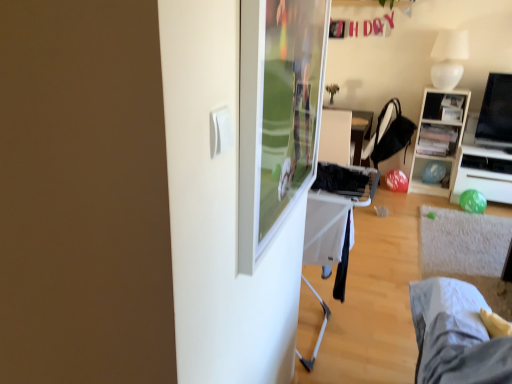
Question: Is black fabric chair at center far from wooden shelf at upper right?

Choices:
 (A) yes
 (B) no

Answer: (B)

Question: Is black fabric chair at center in contact with wooden shelf at upper right?

Choices:
 (A) yes
 (B) no

Answer: (B)

Question: From the image's perspective, would you say black fabric chair at center is positioned over wooden shelf at upper right?

Choices:
 (A) yes
 (B) no

Answer: (A)

Question: Is black fabric chair at center positioned in front of wooden shelf at upper right?

Choices:
 (A) no
 (B) yes

Answer: (B)

Question: Is wooden shelf at upper right completely or partially inside black fabric chair at center?

Choices:
 (A) yes
 (B) no

Answer: (B)

Question: Considering the positions of point (340, 127) and point (373, 144), is point (340, 127) closer or farther from the camera than point (373, 144)?

Choices:
 (A) farther
 (B) closer

Answer: (B)

Question: From their relative heights in the image, would you say black plastic table at center is taller or shorter than black fabric chair at center?

Choices:
 (A) tall
 (B) short

Answer: (A)

Question: Considering the positions of black plastic table at center and black fabric chair at center in the image, is black plastic table at center bigger or smaller than black fabric chair at center?

Choices:
 (A) small
 (B) big

Answer: (B)

Question: From the image's perspective, relative to black fabric chair at center, is black plastic table at center above or below?

Choices:
 (A) below
 (B) above

Answer: (A)

Question: From the image's perspective, is black glossy tv at right located above or below black plastic table at center?

Choices:
 (A) above
 (B) below

Answer: (A)

Question: Is black glossy tv at right inside or outside of black plastic table at center?

Choices:
 (A) inside
 (B) outside

Answer: (B)

Question: Considering their positions, is black glossy tv at right located in front of or behind black plastic table at center?

Choices:
 (A) behind
 (B) front

Answer: (A)

Question: From a real-world perspective, relative to black plastic table at center, is black glossy tv at right vertically above or below?

Choices:
 (A) below
 (B) above

Answer: (B)

Question: From a real-world perspective, is black glossy tv at right physically located above or below white fabric bed at lower right?

Choices:
 (A) above
 (B) below

Answer: (A)

Question: Looking at their shapes, would you say black glossy tv at right is wider or thinner than white fabric bed at lower right?

Choices:
 (A) wide
 (B) thin

Answer: (B)